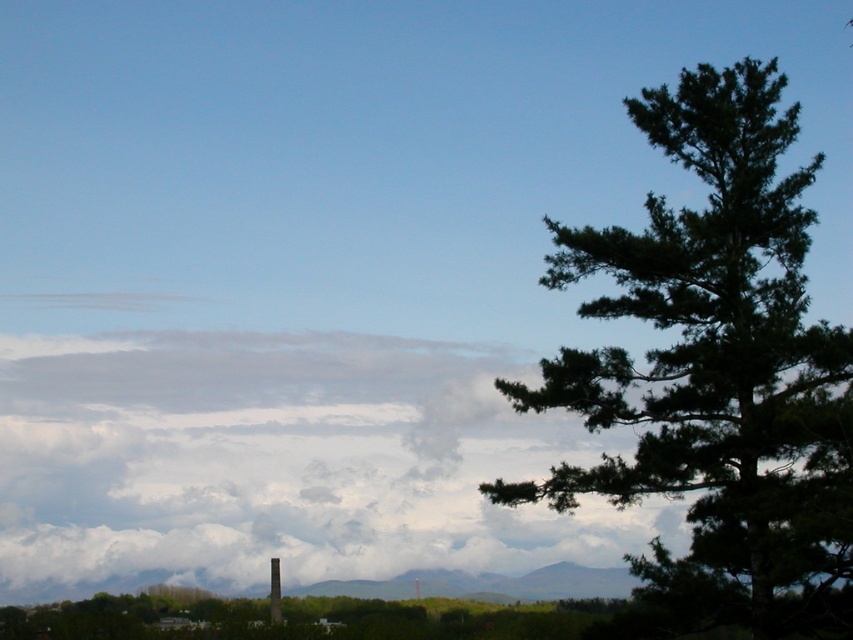
You are an airplane pilot preparing for takeoff. You notice the cloudy white cloud at upper left and the dark green pine tree at right in your view. Which object is closer to your plane?

The cloudy white cloud at upper left is closer to the plane because it is further to the viewer than the dark green pine tree at right, meaning it appears nearer in the visual perspective.

You are a drone operator who needs to fly a drone from the cloudy white cloud at upper left to the dark green pine tree at right. What is the approximate distance you need to cover?

The cloudy white cloud at upper left and dark green pine tree at right are 11.81 meters apart, so the drone needs to cover approximately 11.81 meters.

You are an airplane pilot flying at a high altitude. You notice a cloudy white cloud at upper left and a dark green pine tree at right from your cockpit window. Which object is closer to the ground?

The dark green pine tree at right is closer to the ground because the cloudy white cloud at upper left is positioned below it, meaning the cloud is lower in the sky but still above the tree.